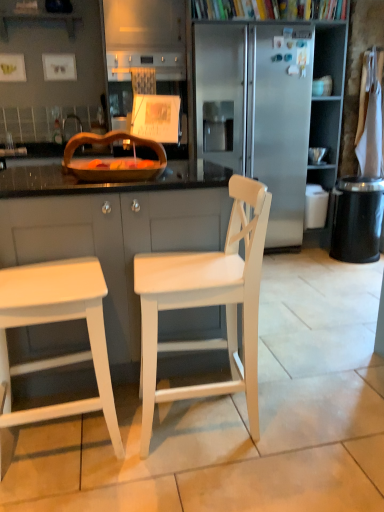
Measure the distance between point (67, 164) and camera.

The distance of point (67, 164) from camera is 1.66 meters.

Measure the distance between point (3, 416) and camera.

A distance of 4.75 feet exists between point (3, 416) and camera.

Image resolution: width=384 pixels, height=512 pixels. What do you see at coordinates (260, 111) in the screenshot?
I see `stainless steel refrigerator at center` at bounding box center [260, 111].

Image resolution: width=384 pixels, height=512 pixels. What do you see at coordinates (112, 228) in the screenshot? I see `white wood cabinet at center` at bounding box center [112, 228].

Where is `brushed metal faucet at upper center`? Image resolution: width=384 pixels, height=512 pixels. brushed metal faucet at upper center is located at coordinates (71, 126).

Is white matte stool at left situated inside brushed metal faucet at upper center or outside?

white matte stool at left is spatially situated outside brushed metal faucet at upper center.

Can you confirm if white matte stool at left is positioned to the right of brushed metal faucet at upper center?

Yes.

Would you consider white matte stool at left to be distant from brushed metal faucet at upper center?

That's right, there is a large distance between white matte stool at left and brushed metal faucet at upper center.

Is white matte chair at center not within black textured trash can at right?

Yes, white matte chair at center is not within black textured trash can at right.

Can you confirm if white matte chair at center is bigger than black textured trash can at right?

Yes, white matte chair at center is bigger than black textured trash can at right.

Can you tell me how much white matte chair at center and black textured trash can at right differ in facing direction?

1.6 degrees.

Locate an element on the screen. The height and width of the screenshot is (512, 384). trash bin/can located on the right of white matte chair at center is located at coordinates (357, 219).

Does black textured trash can at right have a smaller size compared to white wood cabinet at center?

Indeed, black textured trash can at right has a smaller size compared to white wood cabinet at center.

In terms of width, does black textured trash can at right look wider or thinner when compared to white wood cabinet at center?

In the image, black textured trash can at right appears to be more narrow than white wood cabinet at center.

Based on the photo, is black textured trash can at right aimed at white wood cabinet at center?

No, black textured trash can at right is not aimed at white wood cabinet at center.

Are black textured trash can at right and white wood cabinet at center making contact?

There is a gap between black textured trash can at right and white wood cabinet at center.

Considering the sizes of objects white matte chair at center and wooden tray at center in the image provided, who is shorter, white matte chair at center or wooden tray at center?

wooden tray at center is shorter.

Is wooden tray at center a part of white matte chair at center?

No, wooden tray at center is not inside white matte chair at center.

Is white matte chair at center facing away from wooden tray at center?

No, white matte chair at center is not facing the opposite direction of wooden tray at center.

Does point (246, 189) come farther from viewer compared to point (157, 168)?

That is False.

How many degrees apart are the facing directions of white matte stool at left and white matte chair at center?

The facing directions of white matte stool at left and white matte chair at center are 176 degrees apart.

Is white matte stool at left surrounding white matte chair at center?

No.

Does white matte stool at left have a lesser width compared to white matte chair at center?

Correct, the width of white matte stool at left is less than that of white matte chair at center.

Does point (246, 62) appear closer or farther from the camera than point (343, 181)?

Point (246, 62).

Looking at this image, which object is positioned more to the left, stainless steel refrigerator at center or black textured trash can at right?

Positioned to the left is stainless steel refrigerator at center.

Looking at the image, does stainless steel refrigerator at center seem bigger or smaller compared to black textured trash can at right?

Clearly, stainless steel refrigerator at center is larger in size than black textured trash can at right.

Would you say brushed metal faucet at upper center is a long distance from black textured trash can at right?

Indeed, brushed metal faucet at upper center is not near black textured trash can at right.

From the picture: Who is shorter, brushed metal faucet at upper center or black textured trash can at right?

brushed metal faucet at upper center is shorter.

Find the location of `trash bin/can that is under the brushed metal faucet at upper center (from a real-world perspective)`. trash bin/can that is under the brushed metal faucet at upper center (from a real-world perspective) is located at coordinates (357, 219).

Consider the image. How different are the orientations of brushed metal faucet at upper center and black textured trash can at right in degrees?

They differ by 53.5 degrees in their facing directions.

At what (x,y) coordinates should I click in order to perform the action: click on faucet behind the white matte stool at left. Please return your answer as a coordinate pair (x, y). Looking at the image, I should click on (71, 126).

The image size is (384, 512). I want to click on trash bin/can on the right of the white matte chair at center, so click(x=357, y=219).

Considering their positions, is wooden tray at center positioned further to brushed metal faucet at upper center than black textured trash can at right?

The object further to brushed metal faucet at upper center is black textured trash can at right.

When comparing their distances from brushed metal faucet at upper center, does white matte stool at left or black textured trash can at right seem further?

white matte stool at left lies further to brushed metal faucet at upper center than the other object.

Which object lies further to the anchor point white matte chair at center, wooden tray at center or white wood cabinet at center?

wooden tray at center lies further to white matte chair at center than the other object.

Considering their positions, is brushed metal faucet at upper center positioned further to black textured trash can at right than white matte stool at left?

white matte stool at left lies further to black textured trash can at right than the other object.

Looking at the image, which one is located further to black textured trash can at right, wooden tray at center or brushed metal faucet at upper center?

Based on the image, brushed metal faucet at upper center appears to be further to black textured trash can at right.

Estimate the real-world distances between objects in this image. Which object is closer to stainless steel refrigerator at center, white wood cabinet at center or brushed metal faucet at upper center?

Based on the image, brushed metal faucet at upper center appears to be nearer to stainless steel refrigerator at center.

Looking at the image, which one is located further to white wood cabinet at center, white matte chair at center or wooden tray at center?

Based on the image, white matte chair at center appears to be further to white wood cabinet at center.

Consider the image. From the image, which object appears to be nearer to white wood cabinet at center, brushed metal faucet at upper center or white matte chair at center?

white matte chair at center is positioned closer to the anchor white wood cabinet at center.

Where is `trash bin/can between white matte stool at left and brushed metal faucet at upper center along the z-axis`? trash bin/can between white matte stool at left and brushed metal faucet at upper center along the z-axis is located at coordinates (357, 219).

Locate an element on the screen. This screenshot has height=512, width=384. cabinetry positioned between white matte stool at left and black textured trash can at right from near to far is located at coordinates (112, 228).

Locate an element on the screen. chair positioned between white matte stool at left and stainless steel refrigerator at center from near to far is located at coordinates (207, 305).

Find the location of a particular element. The width and height of the screenshot is (384, 512). cabinetry between wooden tray at center and white matte stool at left from top to bottom is located at coordinates (112, 228).